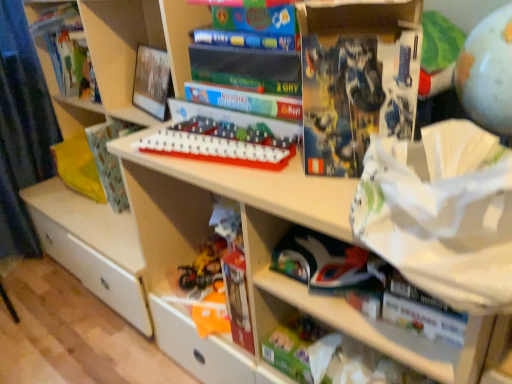
Identify the location of free point to the left of blue matte book at upper center, which ranks as the first paperback book in right-to-left order. (272, 180).